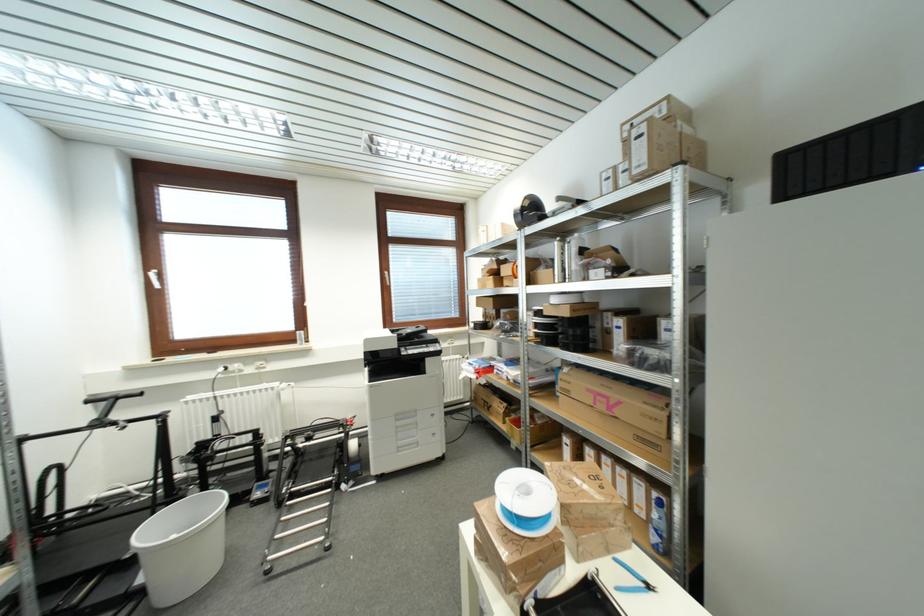
At what (x,y) coordinates should I click in order to perform the action: click on white window handle. Please return your answer as a coordinate pair (x, y). Image resolution: width=924 pixels, height=616 pixels. Looking at the image, I should click on [153, 278].